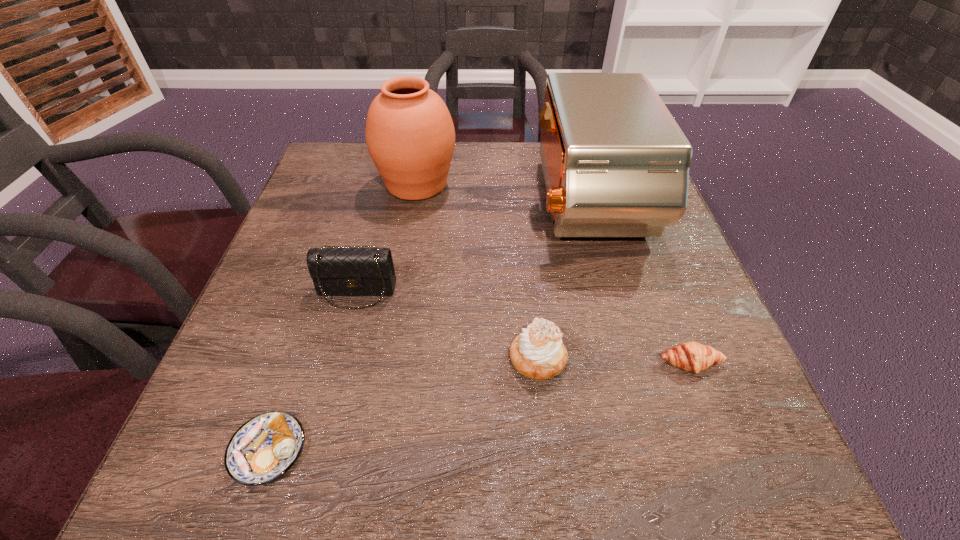
Find the location of a particular element. toaster oven present at the right edge is located at coordinates (616, 164).

Where is `pastry that is positioned at the right edge`? This screenshot has height=540, width=960. pastry that is positioned at the right edge is located at coordinates (691, 356).

The height and width of the screenshot is (540, 960). In order to click on object that is at the near left corner in this screenshot , I will do `click(265, 447)`.

I want to click on object present at the far right corner, so click(616, 164).

Find the location of a particular element. vacant position at the far edge of the desktop is located at coordinates (493, 163).

Where is `vacant region at the left edge of the desktop`? The width and height of the screenshot is (960, 540). vacant region at the left edge of the desktop is located at coordinates (304, 361).

In the image, there is a desktop. At what (x,y) coordinates should I click in order to perform the action: click on free space at the far left corner. Please return your answer as a coordinate pair (x, y). This screenshot has width=960, height=540. Looking at the image, I should click on (330, 177).

You are a GUI agent. You are given a task and a screenshot of the screen. Output one action in this format:
    pyautogui.click(x=<x>, y=<y>)
    Task: Click on the free space at the near right corner
    The image size is (960, 540).
    Given the screenshot: What is the action you would take?
    pyautogui.click(x=733, y=496)

Where is `free space that is in between the second pastry from left to right and the urn`? free space that is in between the second pastry from left to right and the urn is located at coordinates [477, 272].

Where is `vacant area that lies between the tallest pastry and the toaster oven`? vacant area that lies between the tallest pastry and the toaster oven is located at coordinates (563, 282).